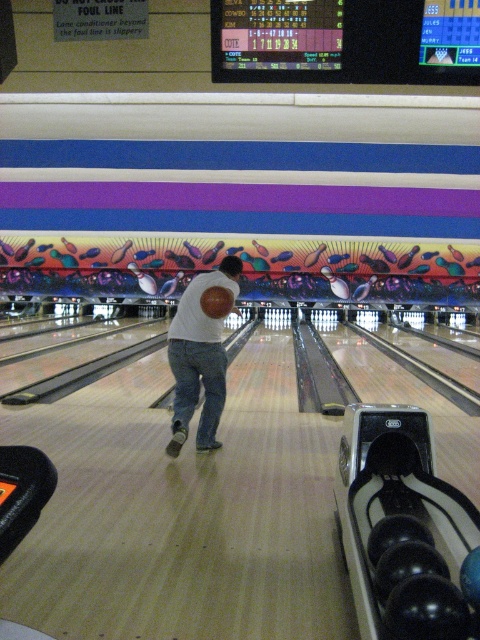
Question: Is white matte shirt at center wider than blue denim jeans at center?

Choices:
 (A) no
 (B) yes

Answer: (B)

Question: Is white matte shirt at center to the right of blue denim jeans at center from the viewer's perspective?

Choices:
 (A) no
 (B) yes

Answer: (B)

Question: Which point is closer to the camera taking this photo?

Choices:
 (A) (192, 342)
 (B) (193, 371)

Answer: (A)

Question: Among these objects, which one is nearest to the camera?

Choices:
 (A) white matte shirt at center
 (B) blue denim jeans at center

Answer: (A)

Question: Can you confirm if white matte shirt at center is bigger than blue denim jeans at center?

Choices:
 (A) no
 (B) yes

Answer: (B)